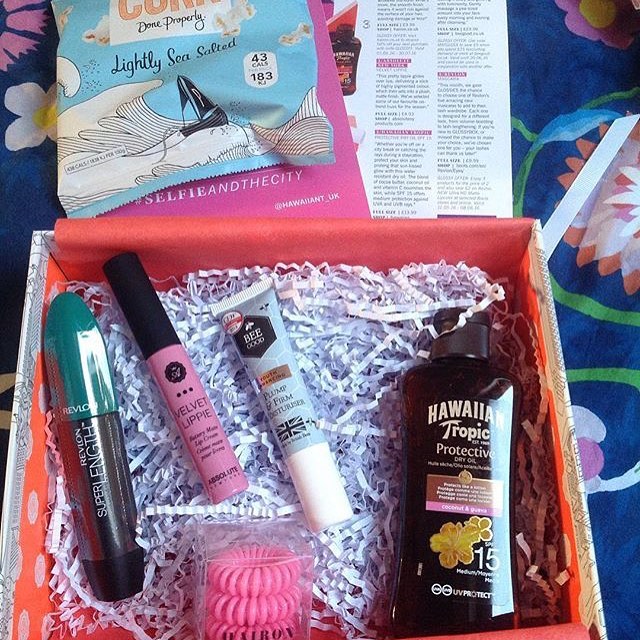
This screenshot has width=640, height=640. Find the location of `makeup container with teal cap`. makeup container with teal cap is located at coordinates (107, 493), (70, 352).